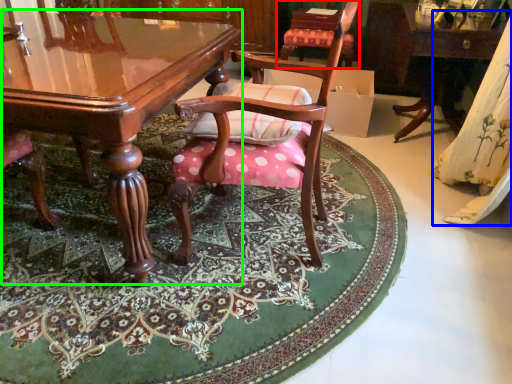
Question: Estimate the real-world distances between objects in this image. Which object is closer to chair (highlighted by a red box), curtain (highlighted by a blue box) or table (highlighted by a green box)?

Choices:
 (A) curtain
 (B) table

Answer: (A)